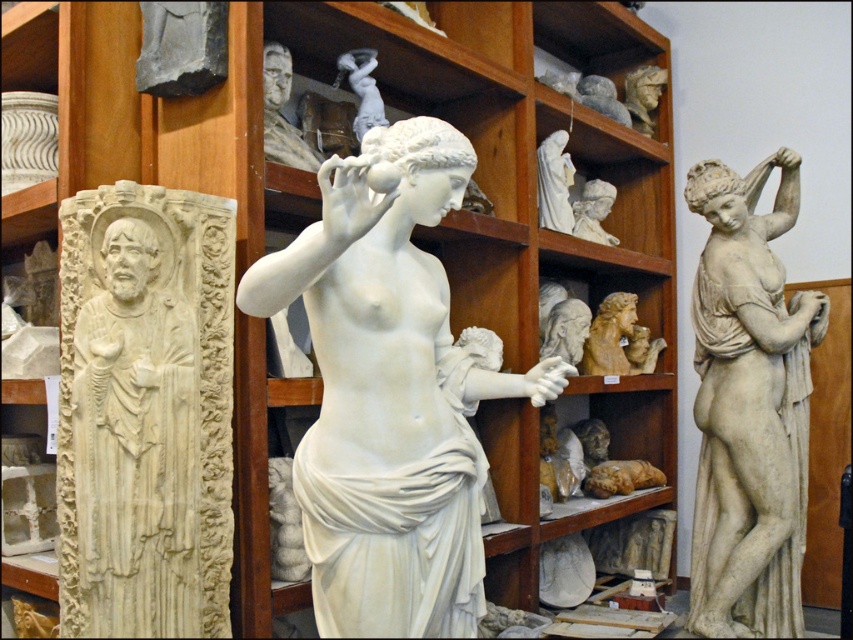
Question: In this image, where is white marble statue at right located relative to light brown wood carving at center?

Choices:
 (A) right
 (B) left

Answer: (A)

Question: Can you confirm if white marble statue at right is positioned below light brown wood carving at center?

Choices:
 (A) no
 (B) yes

Answer: (B)

Question: Which of the following is the closest to the observer?

Choices:
 (A) (612, 308)
 (B) (224, 396)
 (C) (399, 276)

Answer: (C)

Question: Does white marble relief at left appear under light brown wood carving at center?

Choices:
 (A) yes
 (B) no

Answer: (A)

Question: Based on their relative distances, which object is nearer to the white marble statue at center?

Choices:
 (A) white marble relief at left
 (B) white marble statue at right
 (C) light brown wood carving at center

Answer: (A)

Question: Which object appears farthest from the camera in this image?

Choices:
 (A) white marble statue at center
 (B) light brown wood carving at center
 (C) white marble statue at right
 (D) white marble relief at left

Answer: (B)